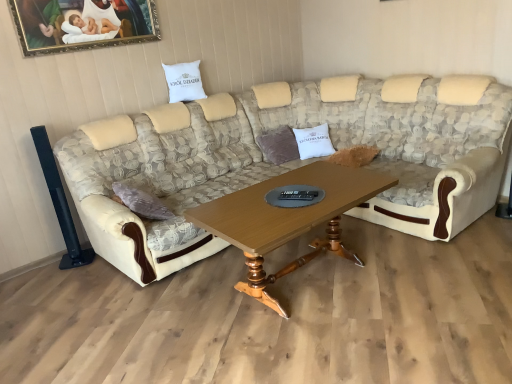
Describe the element at coordinates (184, 82) in the screenshot. I see `white fabric pillow at upper center, which ranks as the 2th pillow in bottom-to-top order` at that location.

Where is `white fabric pillow at upper center, which ranks as the first pillow in left-to-right order`? The width and height of the screenshot is (512, 384). white fabric pillow at upper center, which ranks as the first pillow in left-to-right order is located at coordinates (184, 82).

Where is `woodenwoodencoffee table at center`? The width and height of the screenshot is (512, 384). woodenwoodencoffee table at center is located at coordinates (288, 219).

From the picture: What is the approximate height of beige fabric couch at center?

1.06 meters.

This screenshot has height=384, width=512. What do you see at coordinates (82, 24) in the screenshot?
I see `gold-framed painting at upper left` at bounding box center [82, 24].

I want to click on white fabric pillow at upper center, which ranks as the 2th pillow in bottom-to-top order, so click(184, 82).

Is gold-framed painting at upper left not within white cotton pillow at center, placed as the 1th pillow when sorted from right to left?

Indeed, gold-framed painting at upper left is completely outside white cotton pillow at center, placed as the 1th pillow when sorted from right to left.

At what (x,y) coordinates should I click in order to perform the action: click on picture frame located in front of the white cotton pillow at center, the first pillow positioned from the bottom. Please return your answer as a coordinate pair (x, y). Looking at the image, I should click on click(82, 24).

Looking at this image, is gold-framed painting at upper left facing away from white cotton pillow at center, placed as the 1th pillow when sorted from right to left?

That's not correct — gold-framed painting at upper left is not looking away from white cotton pillow at center, placed as the 1th pillow when sorted from right to left.

Looking at this image, is gold-framed painting at upper left next to white cotton pillow at center, placed as the second pillow when sorted from top to bottom, and touching it?

No, gold-framed painting at upper left is not making contact with white cotton pillow at center, placed as the second pillow when sorted from top to bottom.

Considering the relative sizes of white cotton pillow at center, the first pillow positioned from the bottom, and gold-framed painting at upper left in the image provided, is white cotton pillow at center, the first pillow positioned from the bottom, thinner than gold-framed painting at upper left?

Incorrect, the width of white cotton pillow at center, the first pillow positioned from the bottom, is not less than that of gold-framed painting at upper left.

Does white cotton pillow at center, the first pillow positioned from the bottom, appear on the left side of gold-framed painting at upper left?

In fact, white cotton pillow at center, the first pillow positioned from the bottom, is to the right of gold-framed painting at upper left.

From the image's perspective, which is above, white cotton pillow at center, arranged as the second pillow when viewed from the left, or gold-framed painting at upper left?

gold-framed painting at upper left.

Who is shorter, gold-framed painting at upper left or white fabric pillow at upper center, the 1th pillow when ordered from top to bottom?

Standing shorter between the two is white fabric pillow at upper center, the 1th pillow when ordered from top to bottom.

From the image's perspective, who appears lower, gold-framed painting at upper left or white fabric pillow at upper center, arranged as the second pillow when viewed from the right?

white fabric pillow at upper center, arranged as the second pillow when viewed from the right, is shown below in the image.

Which object is positioned more to the left, gold-framed painting at upper left or white fabric pillow at upper center, arranged as the second pillow when viewed from the right?

gold-framed painting at upper left.

Is point (103, 24) in front of point (176, 100)?

Yes, it is in front of point (176, 100).

Could you tell me if white fabric pillow at upper center, which ranks as the first pillow in left-to-right order, is turned towards beige fabric couch at center?

No.

Is point (189, 97) farther from viewer compared to point (376, 110)?

No, (189, 97) is in front of (376, 110).

From a real-world perspective, is white fabric pillow at upper center, which ranks as the first pillow in left-to-right order, on beige fabric couch at center?

Indeed, from a real-world perspective, white fabric pillow at upper center, which ranks as the first pillow in left-to-right order, stands above beige fabric couch at center.

In the scene shown: Is white fabric pillow at upper center, arranged as the second pillow when viewed from the right, positioned behind beige fabric couch at center?

Yes, it is behind beige fabric couch at center.

Which is more to the left, white cotton pillow at center, placed as the 1th pillow when sorted from right to left, or beige fabric couch at center?

beige fabric couch at center.

Does white cotton pillow at center, the first pillow positioned from the bottom, come behind beige fabric couch at center?

Yes, it is.

Considering the relative sizes of white cotton pillow at center, placed as the 1th pillow when sorted from right to left, and beige fabric couch at center in the image provided, is white cotton pillow at center, placed as the 1th pillow when sorted from right to left, thinner than beige fabric couch at center?

Yes, white cotton pillow at center, placed as the 1th pillow when sorted from right to left, is thinner than beige fabric couch at center.

From a real-world perspective, which is physically above, white cotton pillow at center, the first pillow positioned from the bottom, or beige fabric couch at center?

beige fabric couch at center, from a real-world perspective.

Locate an element on the screen. This screenshot has height=384, width=512. studio couch that is above the woodenwoodencoffee table at center (from the image's perspective) is located at coordinates (292, 161).

Is woodenwoodencoffee table at center further to camera compared to beige fabric couch at center?

Yes, woodenwoodencoffee table at center is further from the camera.

Looking at their sizes, would you say woodenwoodencoffee table at center is wider or thinner than beige fabric couch at center?

In the image, woodenwoodencoffee table at center appears to be more narrow than beige fabric couch at center.

Is there a large distance between white cotton pillow at center, placed as the second pillow when sorted from top to bottom, and white fabric pillow at upper center, which ranks as the 2th pillow in bottom-to-top order?

Indeed, white cotton pillow at center, placed as the second pillow when sorted from top to bottom, is not near white fabric pillow at upper center, which ranks as the 2th pillow in bottom-to-top order.

Is white cotton pillow at center, arranged as the second pillow when viewed from the left, smaller than white fabric pillow at upper center, the 1th pillow when ordered from top to bottom?

No, white cotton pillow at center, arranged as the second pillow when viewed from the left, is not smaller than white fabric pillow at upper center, the 1th pillow when ordered from top to bottom.

Considering the sizes of objects white cotton pillow at center, placed as the second pillow when sorted from top to bottom, and white fabric pillow at upper center, which ranks as the 2th pillow in bottom-to-top order, in the image provided, who is taller, white cotton pillow at center, placed as the second pillow when sorted from top to bottom, or white fabric pillow at upper center, which ranks as the 2th pillow in bottom-to-top order,?

white cotton pillow at center, placed as the second pillow when sorted from top to bottom, is taller.

Starting from the gold-framed painting at upper left, which pillow is the 2nd one behind? Please provide its 2D coordinates.

[(314, 142)]

Locate an element on the screen. The image size is (512, 384). picture frame that is in front of the white cotton pillow at center, placed as the second pillow when sorted from top to bottom is located at coordinates (82, 24).

Which object lies further to the anchor point beige fabric couch at center, woodenwoodencoffee table at center or white fabric pillow at upper center, which ranks as the 2th pillow in bottom-to-top order?

white fabric pillow at upper center, which ranks as the 2th pillow in bottom-to-top order, is positioned further to the anchor beige fabric couch at center.

Based on their spatial positions, is woodenwoodencoffee table at center or beige fabric couch at center closer to white fabric pillow at upper center, arranged as the second pillow when viewed from the right?

beige fabric couch at center lies closer to white fabric pillow at upper center, arranged as the second pillow when viewed from the right, than the other object.

From the picture: Estimate the real-world distances between objects in this image. Which object is further from white cotton pillow at center, placed as the 1th pillow when sorted from right to left, woodenwoodencoffee table at center or beige fabric couch at center?

woodenwoodencoffee table at center lies further to white cotton pillow at center, placed as the 1th pillow when sorted from right to left, than the other object.

Looking at the image, which one is located closer to white fabric pillow at upper center, which ranks as the first pillow in left-to-right order, white cotton pillow at center, arranged as the second pillow when viewed from the left, or beige fabric couch at center?

Based on the image, beige fabric couch at center appears to be nearer to white fabric pillow at upper center, which ranks as the first pillow in left-to-right order.

From the image, which object appears to be farther from gold-framed painting at upper left, woodenwoodencoffee table at center or white cotton pillow at center, placed as the 1th pillow when sorted from right to left?

The object further to gold-framed painting at upper left is woodenwoodencoffee table at center.

From the image, which object appears to be farther from woodenwoodencoffee table at center, gold-framed painting at upper left or white cotton pillow at center, placed as the second pillow when sorted from top to bottom?

Among the two, gold-framed painting at upper left is located further to woodenwoodencoffee table at center.

Which object lies further to the anchor point gold-framed painting at upper left, white fabric pillow at upper center, the 1th pillow when ordered from top to bottom, or white cotton pillow at center, placed as the 1th pillow when sorted from right to left?

white cotton pillow at center, placed as the 1th pillow when sorted from right to left, lies further to gold-framed painting at upper left than the other object.

Looking at the image, which one is located closer to beige fabric couch at center, gold-framed painting at upper left or white fabric pillow at upper center, arranged as the second pillow when viewed from the right?

The object closer to beige fabric couch at center is white fabric pillow at upper center, arranged as the second pillow when viewed from the right.

Image resolution: width=512 pixels, height=384 pixels. In order to click on coffee table between beige fabric couch at center and white fabric pillow at upper center, the 1th pillow when ordered from top to bottom, from front to back in this screenshot , I will do `click(288, 219)`.

This screenshot has width=512, height=384. What are the coordinates of `pillow between gold-framed painting at upper left and white cotton pillow at center, placed as the second pillow when sorted from top to bottom, in the horizontal direction` in the screenshot? It's located at 184,82.

Locate an element on the screen. The width and height of the screenshot is (512, 384). picture frame between beige fabric couch at center and white fabric pillow at upper center, arranged as the second pillow when viewed from the right, in the front-back direction is located at coordinates (82, 24).

You are a GUI agent. You are given a task and a screenshot of the screen. Output one action in this format:
    pyautogui.click(x=<x>, y=<y>)
    Task: Click on the coffee table located between gold-framed painting at upper left and beige fabric couch at center in the left-right direction
    
    Given the screenshot: What is the action you would take?
    pyautogui.click(x=288, y=219)